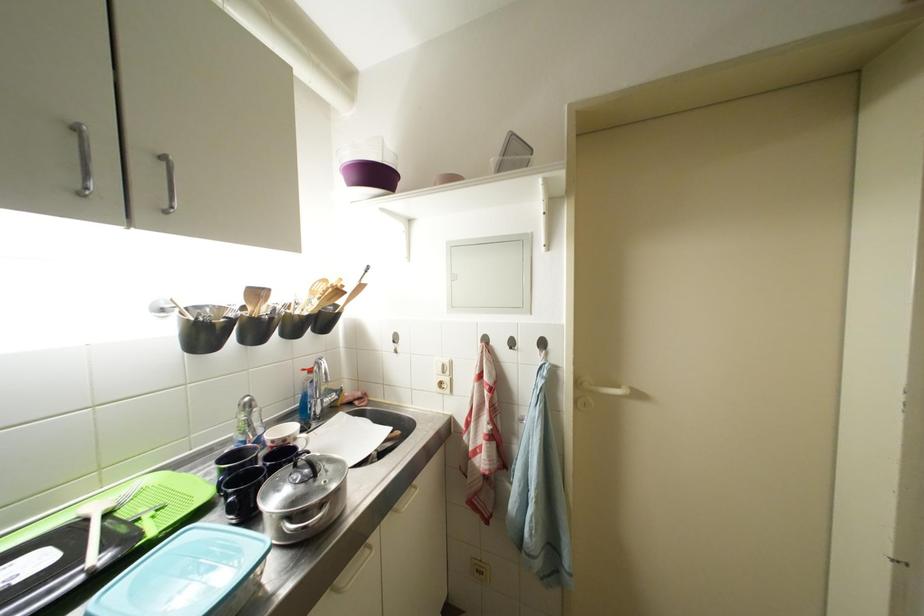
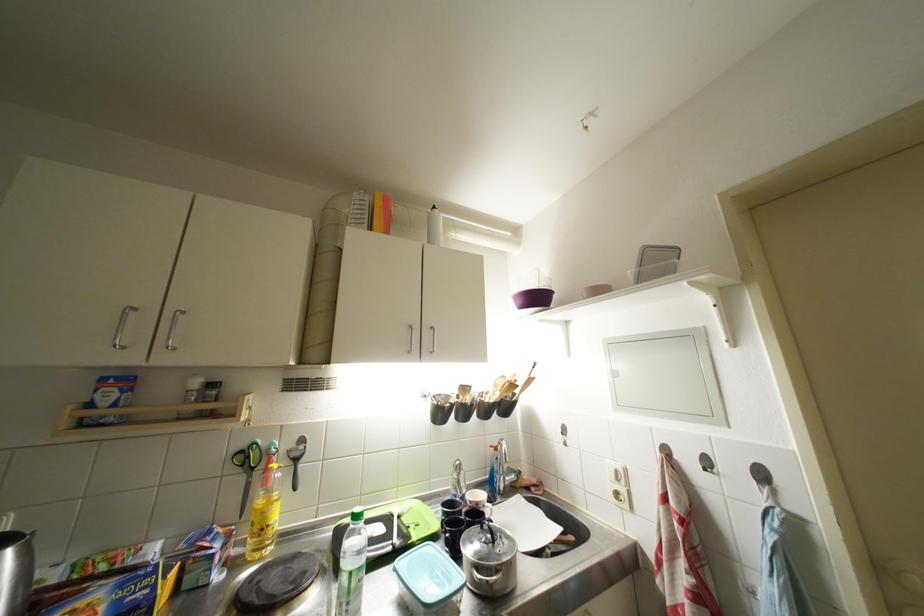
Question: I am providing you with two images of the same scene from different viewpoints. Which of the following objects are not visible in image2?

Choices:
 (A) wooden spatula
 (B) hanging black peeler
 (C) white plastic bottle
 (D) none of these

Answer: (D)